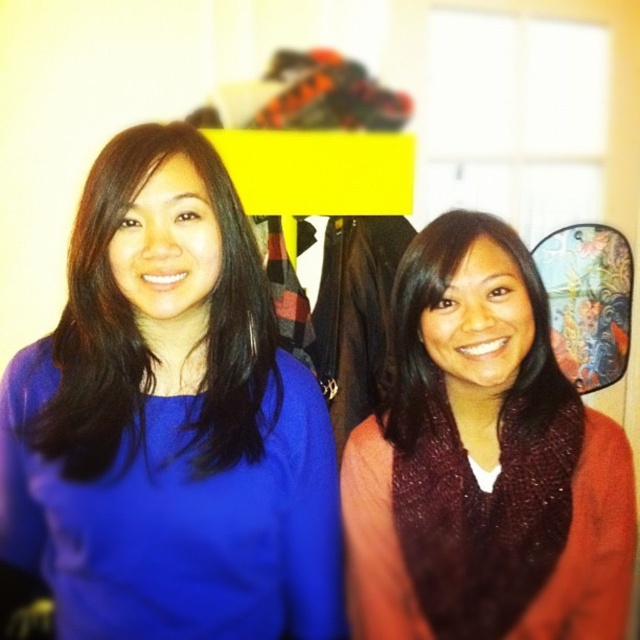
Can you confirm if matte blue sweater at center is positioned to the right of matte maroon sweater at center?

No, matte blue sweater at center is not to the right of matte maroon sweater at center.

Identify the location of matte blue sweater at center. The height and width of the screenshot is (640, 640). point(170,420).

This screenshot has width=640, height=640. What are the coordinates of `matte blue sweater at center` in the screenshot? It's located at (170, 420).

Who is higher up, matte blue sweater at center or knitted maroon scarf at center?

matte blue sweater at center is higher up.

Is matte blue sweater at center wider than knitted maroon scarf at center?

Indeed, matte blue sweater at center has a greater width compared to knitted maroon scarf at center.

Is point (172, 365) positioned in front of point (547, 522)?

Yes, point (172, 365) is in front of point (547, 522).

This screenshot has width=640, height=640. Identify the location of matte blue sweater at center. (170, 420).

Looking at this image, can you confirm if knitted maroon scarf at center is positioned above matte maroon sweater at center?

No.

Between knitted maroon scarf at center and matte maroon sweater at center, which one has more height?

With more height is knitted maroon scarf at center.

Does point (525, 540) come in front of point (449, 272)?

No, it is not.

Where is `knitted maroon scarf at center`? This screenshot has width=640, height=640. knitted maroon scarf at center is located at coordinates (483, 461).